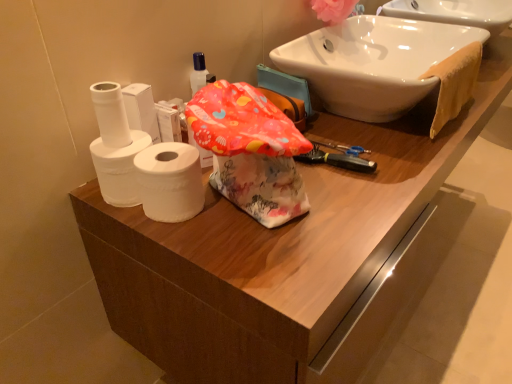
Question: Is white matte toilet paper at left, positioned as the 3th toilet paper in right-to-left order, shorter than pink fabric flower at upper right?

Choices:
 (A) no
 (B) yes

Answer: (B)

Question: Is pink fabric flower at upper right surrounded by white matte toilet paper at left, the first toilet paper from the left?

Choices:
 (A) yes
 (B) no

Answer: (B)

Question: Does white matte toilet paper at left, the first toilet paper from the left, lie in front of pink fabric flower at upper right?

Choices:
 (A) yes
 (B) no

Answer: (A)

Question: From a real-world perspective, is white matte toilet paper at left, the first toilet paper from the left, on top of pink fabric flower at upper right?

Choices:
 (A) no
 (B) yes

Answer: (A)

Question: From a real-world perspective, does white matte toilet paper at left, positioned as the 3th toilet paper in right-to-left order, sit lower than pink fabric flower at upper right?

Choices:
 (A) no
 (B) yes

Answer: (B)

Question: Considering the relative sizes of white matte toilet paper at left, positioned as the 3th toilet paper in right-to-left order, and pink fabric flower at upper right in the image provided, is white matte toilet paper at left, positioned as the 3th toilet paper in right-to-left order, wider than pink fabric flower at upper right?

Choices:
 (A) no
 (B) yes

Answer: (A)

Question: Does white matte toilet paper at left, the 2th toilet paper positioned from the right, have a larger size compared to orange cloth towel at upper right?

Choices:
 (A) no
 (B) yes

Answer: (A)

Question: Is white matte toilet paper at left, the 2th toilet paper positioned from the right, shorter than orange cloth towel at upper right?

Choices:
 (A) no
 (B) yes

Answer: (B)

Question: Is white matte toilet paper at left, placed as the 2th toilet paper when sorted from left to right, not inside orange cloth towel at upper right?

Choices:
 (A) yes
 (B) no

Answer: (A)

Question: Could orange cloth towel at upper right be considered to be inside white matte toilet paper at left, placed as the 2th toilet paper when sorted from left to right?

Choices:
 (A) no
 (B) yes

Answer: (A)

Question: Can you confirm if white matte toilet paper at left, the 2th toilet paper positioned from the right, is taller than orange cloth towel at upper right?

Choices:
 (A) yes
 (B) no

Answer: (B)

Question: Could you tell me if white matte toilet paper at left, the 2th toilet paper positioned from the right, is turned towards orange cloth towel at upper right?

Choices:
 (A) no
 (B) yes

Answer: (A)

Question: Can you confirm if pink fabric flower at upper right is thinner than white glossy sink at upper right?

Choices:
 (A) yes
 (B) no

Answer: (A)